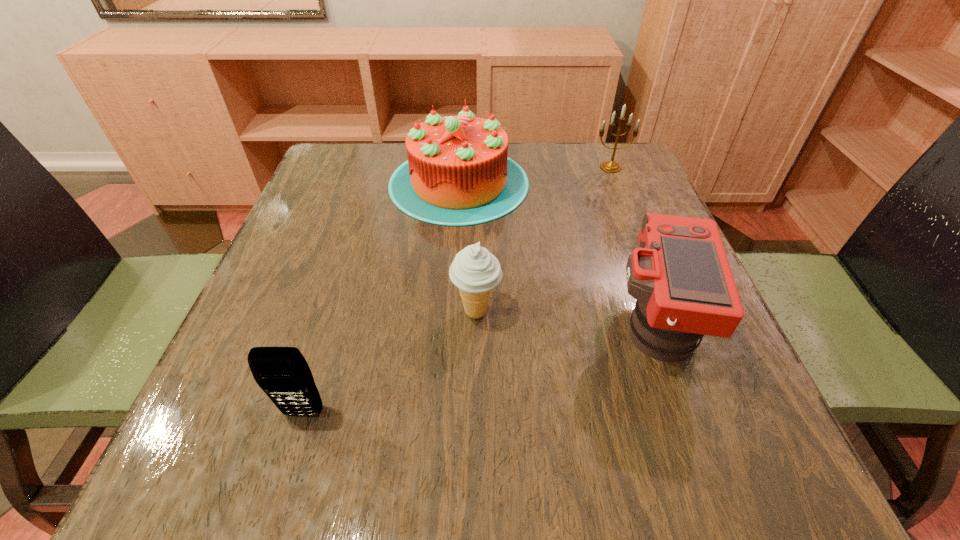
Locate an element on the screen. free space located on the screen of the cellular telephone is located at coordinates (290, 457).

The image size is (960, 540). I want to click on cake located in the far edge section of the desktop, so click(x=458, y=173).

Identify the location of candelabrum that is at the far edge. This screenshot has height=540, width=960. (608, 166).

In order to click on object located in the left edge section of the desktop in this screenshot , I will do `click(282, 373)`.

This screenshot has height=540, width=960. I want to click on candelabrum present at the right edge, so click(608, 166).

You are a GUI agent. You are given a task and a screenshot of the screen. Output one action in this format:
    pyautogui.click(x=<x>, y=<y>)
    Task: Click on the camera that is at the right edge
    Image resolution: width=960 pixels, height=540 pixels.
    Given the screenshot: What is the action you would take?
    pyautogui.click(x=680, y=276)

This screenshot has height=540, width=960. In order to click on object that is at the far right corner in this screenshot , I will do `click(608, 166)`.

Locate an element on the screen. vacant space at the left edge of the desktop is located at coordinates (285, 297).

The image size is (960, 540). What are the coordinates of `blank space at the right edge of the desktop` in the screenshot? It's located at (596, 230).

What are the coordinates of `free region at the far left corner of the desktop` in the screenshot? It's located at (333, 160).